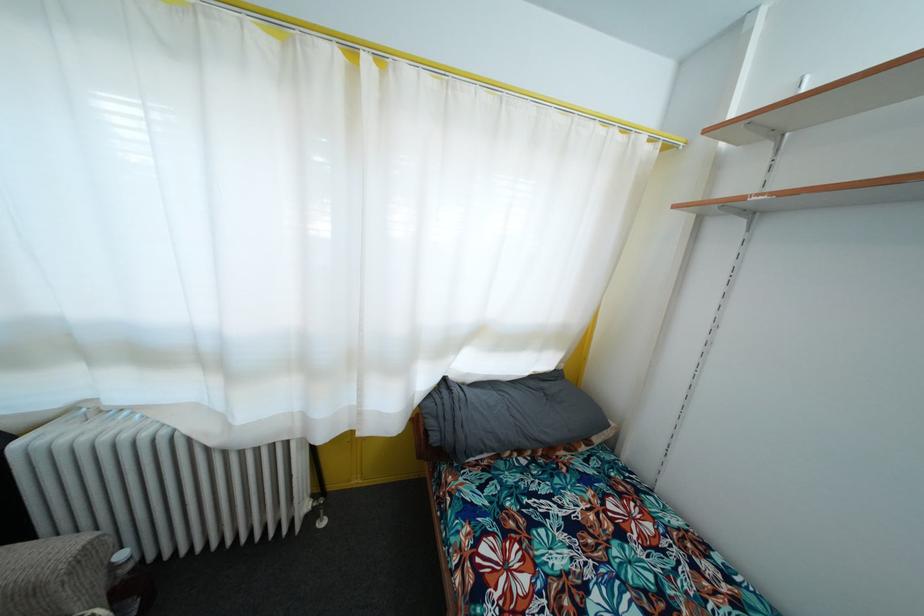
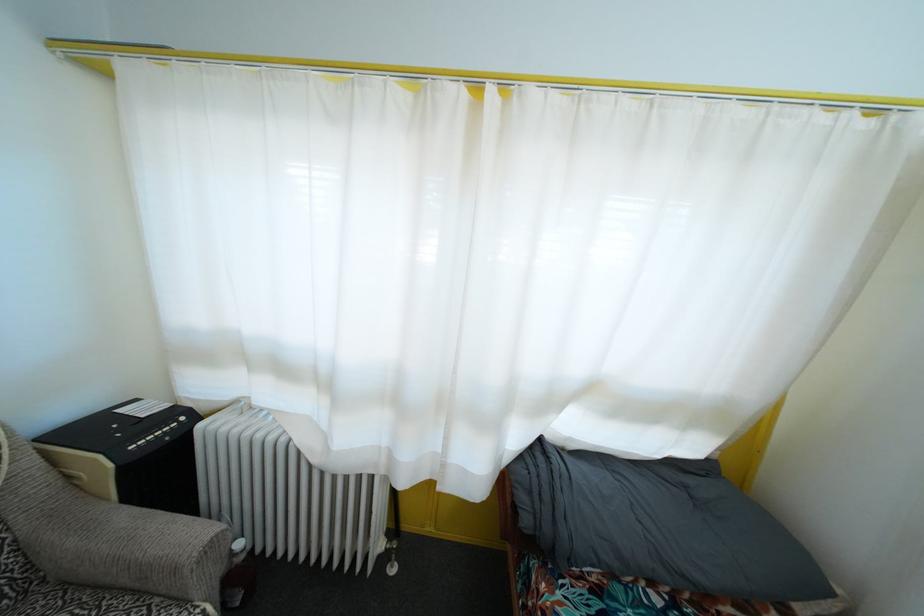
In a continuous first-person perspective shot, in which direction is the camera moving?

The cameraman moved toward left, forward.